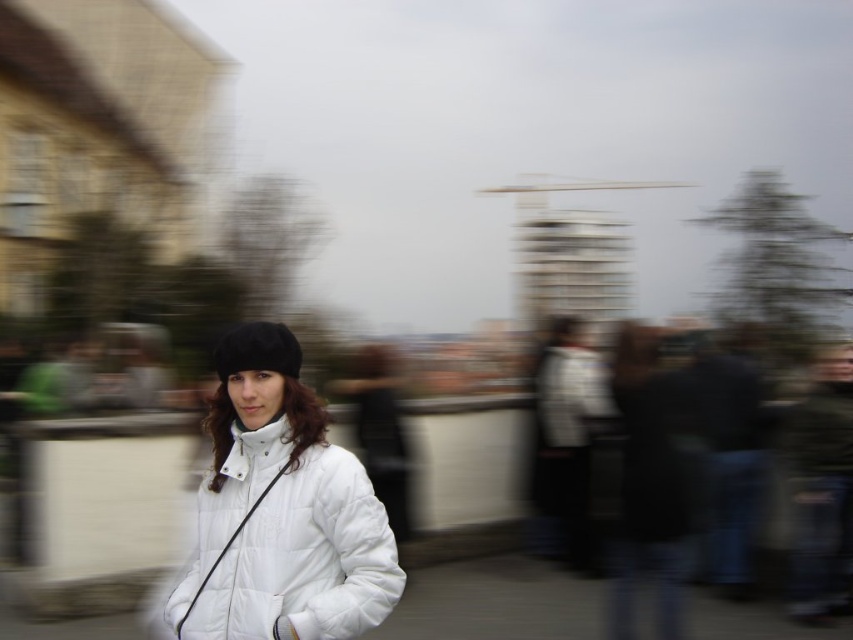
You are a fashion designer observing the image. You need to determine which item is shorter in height between the white fabric jacket at lower center and the black fuzzy hat at center. Which one is it?

The white fabric jacket at lower center has a lesser height compared to the black fuzzy hat at center, so the white fabric jacket at lower center is shorter in height.